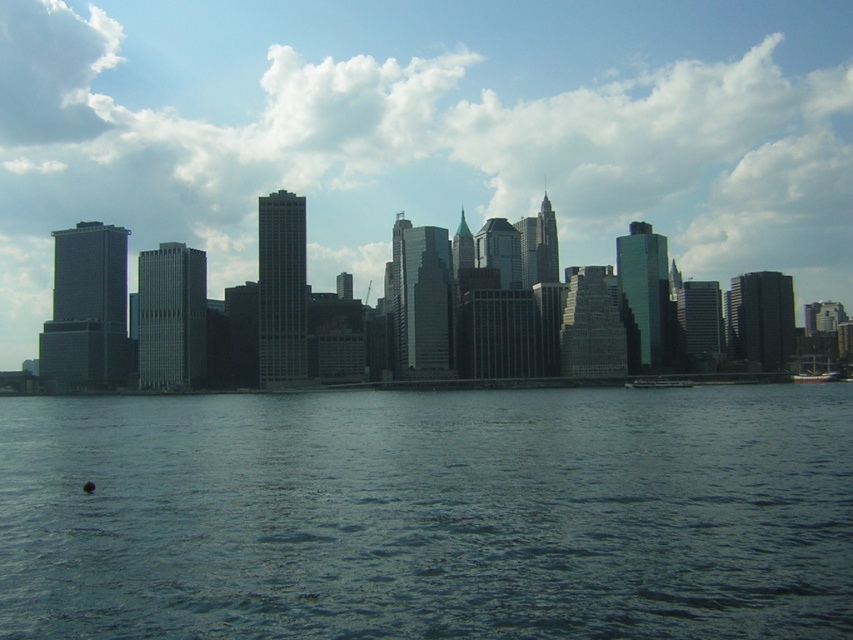
Can you confirm if transparent glass skyscrapers at center is wider than dark blue water at lower center?

Indeed, transparent glass skyscrapers at center has a greater width compared to dark blue water at lower center.

Consider the image. Who is lower down, transparent glass skyscrapers at center or dark blue water at lower center?

dark blue water at lower center is below.

Identify the location of transparent glass skyscrapers at center. (425, 131).

Where is `transparent glass skyscrapers at center`? transparent glass skyscrapers at center is located at coordinates (425, 131).

What do you see at coordinates (425, 131) in the screenshot?
I see `transparent glass skyscrapers at center` at bounding box center [425, 131].

Does point (215, 26) come in front of point (799, 358)?

That is False.

At what (x,y) coordinates should I click in order to perform the action: click on transparent glass skyscrapers at center. Please return your answer as a coordinate pair (x, y). The width and height of the screenshot is (853, 640). Looking at the image, I should click on click(425, 131).

Is the position of transparent glass skyscrapers at center more distant than that of metallic silver boat at lower right?

Yes, it is.

Is transparent glass skyscrapers at center positioned before metallic silver boat at lower right?

No, it is not.

Describe the element at coordinates (425, 131) in the screenshot. This screenshot has height=640, width=853. I see `transparent glass skyscrapers at center` at that location.

The width and height of the screenshot is (853, 640). Identify the location of transparent glass skyscrapers at center. (425, 131).